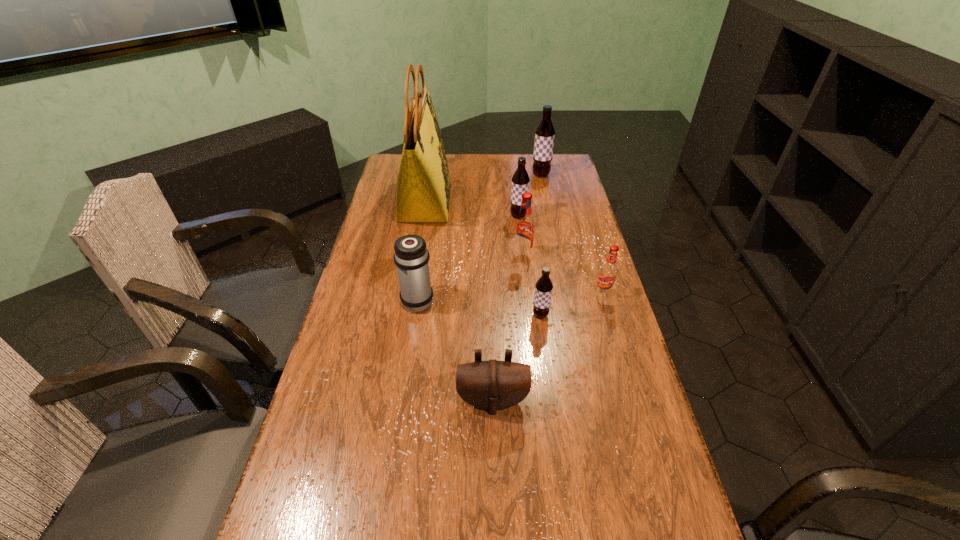
Image resolution: width=960 pixels, height=540 pixels. I want to click on blank area located on the side with the handle of the thermos bottle, so click(x=427, y=239).

Identify the location of vacant space located on the side with the handle of the thermos bottle. (426, 246).

Find the location of `vacant area located 0.110m on the front of the nearer red root beer`. vacant area located 0.110m on the front of the nearer red root beer is located at coordinates (613, 326).

Identify the location of vacant point located 0.180m on the left of the nearest root beer. (470, 315).

What are the coordinates of `vacant space situated 0.210m with the flap open on the nearest object` in the screenshot? It's located at (495, 510).

Locate an element on the screen. This screenshot has height=540, width=960. tote bag that is at the far edge is located at coordinates (423, 186).

Where is `root beer positioned at the far edge`? This screenshot has width=960, height=540. root beer positioned at the far edge is located at coordinates (545, 132).

Identify the location of object that is at the left edge. Image resolution: width=960 pixels, height=540 pixels. (423, 186).

What are the coordinates of `object that is at the far left corner` in the screenshot? It's located at (423, 186).

Where is `object that is positioned at the far right corner`? The width and height of the screenshot is (960, 540). object that is positioned at the far right corner is located at coordinates (545, 132).